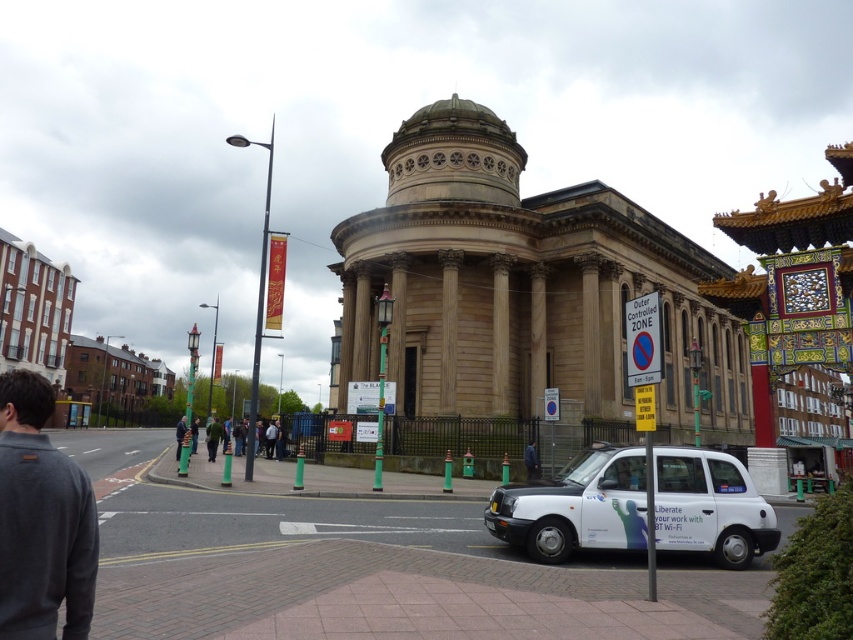
You are standing at the entrance of the classical building with a dome and columns and want to hail a taxi. According to the image, where should you look to find the white matte taxi at lower right?

The white matte taxi at lower right is located at point [575,506], so you should look towards the lower right area of the image to find it.

From the picture: You are a photographer wanting to capture a clear shot of the dark blue jacket at center without the dark gray fleece at lower left blocking it. What adjustment should you make to your camera angle?

The dark gray fleece at lower left is positioned over the dark blue jacket at center. To avoid the fleece blocking the jacket, you should lower your camera angle to shoot under the fleece.